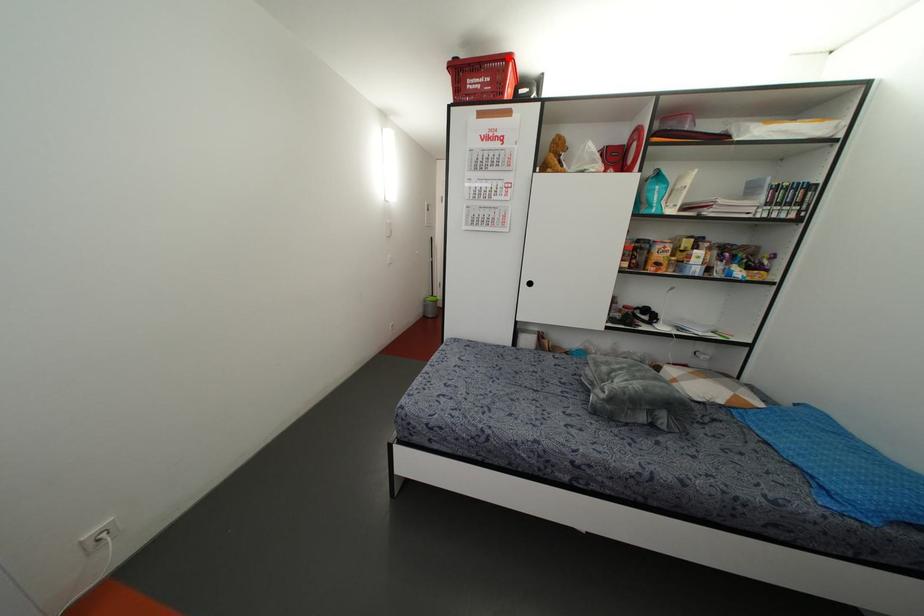
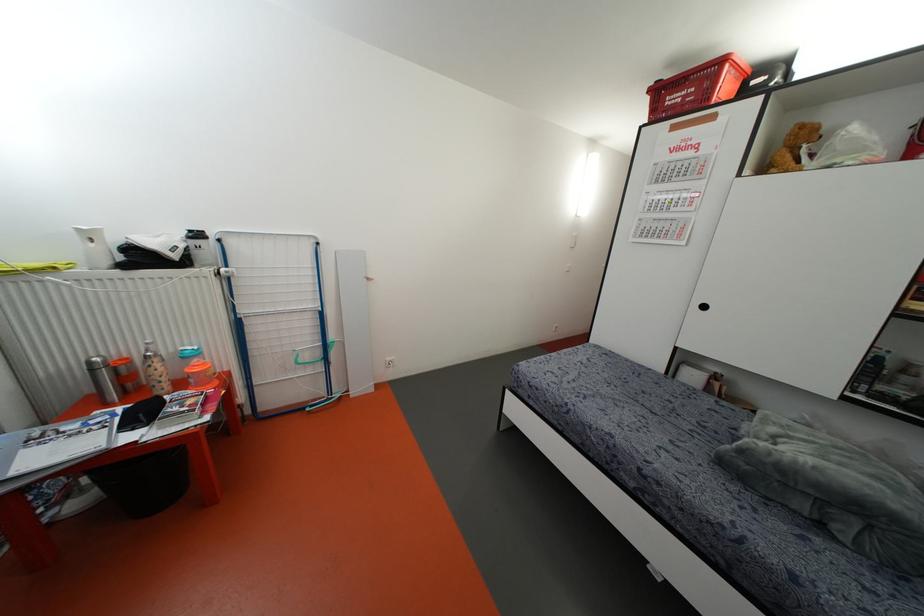
Question: I am providing you with two images of the same scene from different viewpoints. A red point is marked on the first image. Is the red point's position out of view in image 2?

Choices:
 (A) Yes
 (B) No

Answer: (B)